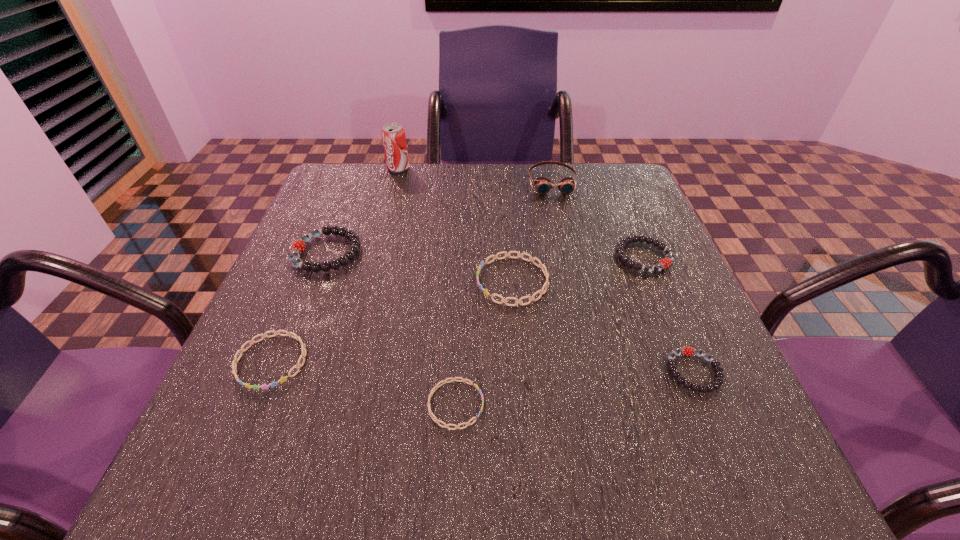
Where is `vacant region located on the surface of the smallest blue bracelet showing star-shaped elements`? This screenshot has height=540, width=960. vacant region located on the surface of the smallest blue bracelet showing star-shaped elements is located at coordinates point(540,404).

I want to click on soda can at the far edge, so click(x=393, y=135).

The width and height of the screenshot is (960, 540). I want to click on goggles at the far edge, so click(543, 185).

This screenshot has width=960, height=540. Find the location of `soda can that is at the left edge`. soda can that is at the left edge is located at coordinates (393, 135).

In order to click on object that is positioned at the far left corner in this screenshot , I will do `click(393, 135)`.

This screenshot has width=960, height=540. What are the coordinates of `blank area at the far edge` in the screenshot? It's located at point(477,184).

The height and width of the screenshot is (540, 960). In the image, there is a desktop. Identify the location of vacant space at the near edge. (432, 463).

You are a GUI agent. You are given a task and a screenshot of the screen. Output one action in this format:
    pyautogui.click(x=<x>, y=<y>)
    Task: Click on the vacant space at the left edge of the desktop
    This screenshot has height=540, width=960.
    Given the screenshot: What is the action you would take?
    pyautogui.click(x=286, y=353)

Locate an element on the screen. The image size is (960, 540). vacant region at the right edge of the desktop is located at coordinates (727, 415).

Identify the location of vacant space at the far right corner. (583, 174).